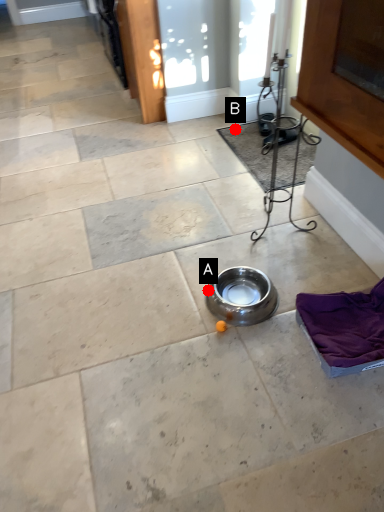
Question: Two points are circled on the image, labeled by A and B beside each circle. Which point is closer to the camera taking this photo?

Choices:
 (A) A is closer
 (B) B is closer

Answer: (A)